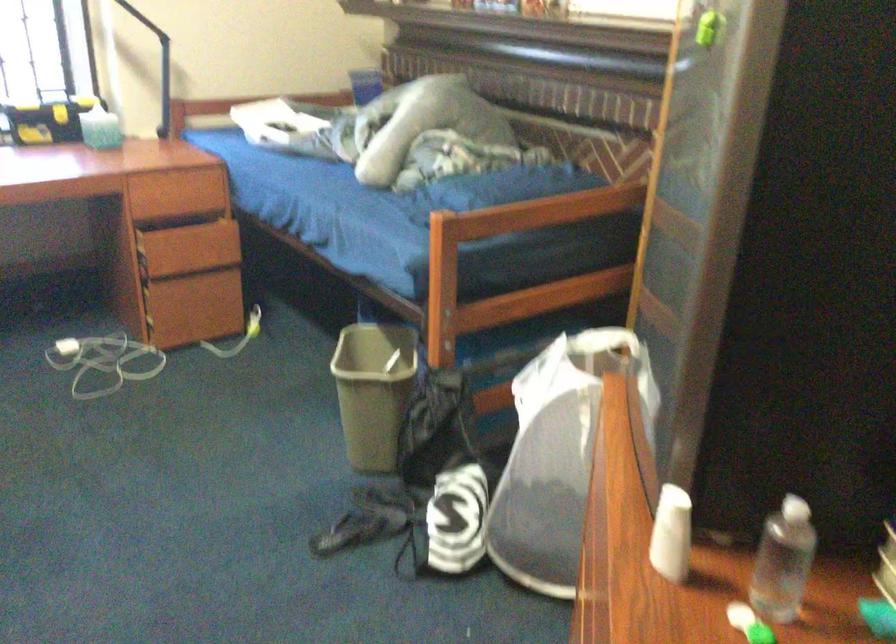
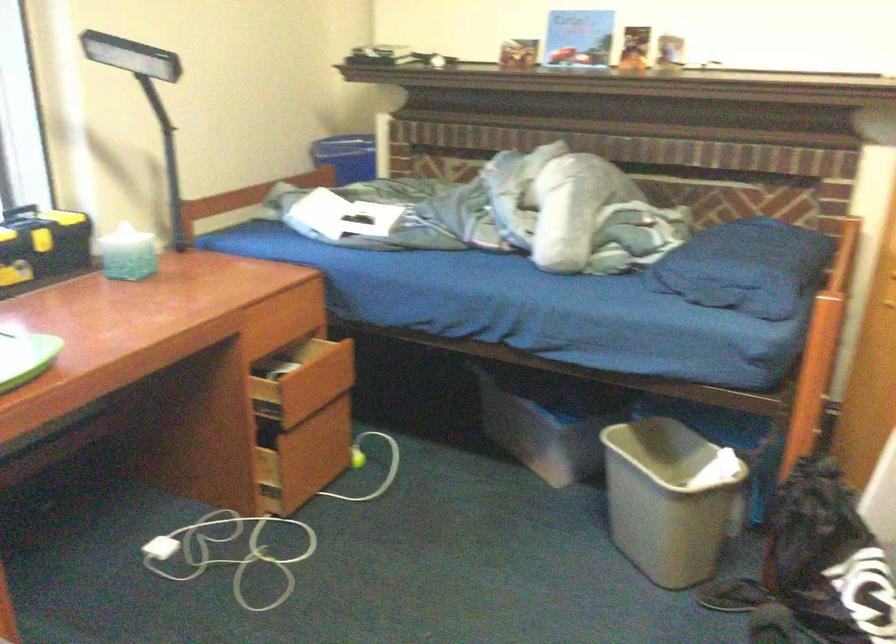
The images are taken continuously from a first-person perspective. In which direction are you moving?

The cameraman moved toward left, forward.